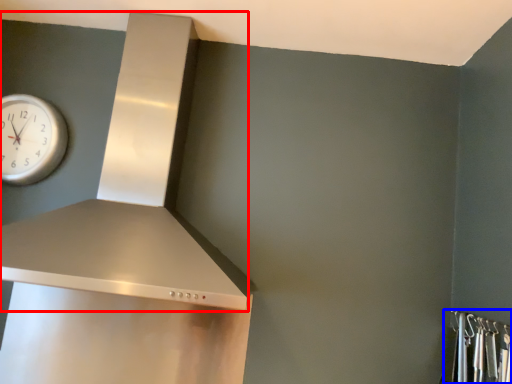
Question: Which object appears farthest to the camera in this image, vent (highlighted by a red box) or closet (highlighted by a blue box)?

Choices:
 (A) vent
 (B) closet

Answer: (A)